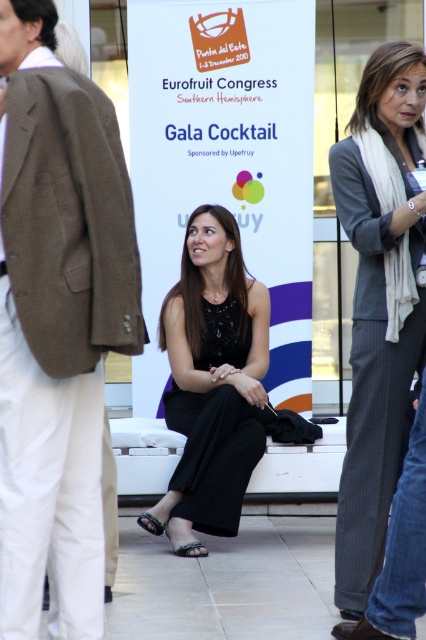
You are a photographer at the Eurofruit Congress Southern Hemisphere Gala Cocktail. You need to capture a photo of both the black satin dress at center and the gray pinstripe blazer at right. Given that your camera frame can only accommodate one of them fully, which one should you focus on to ensure it fits entirely within the frame?

The black satin dress at center is larger in size than the gray pinstripe blazer at right, so you should focus on the black satin dress at center to ensure it fits entirely within the frame.